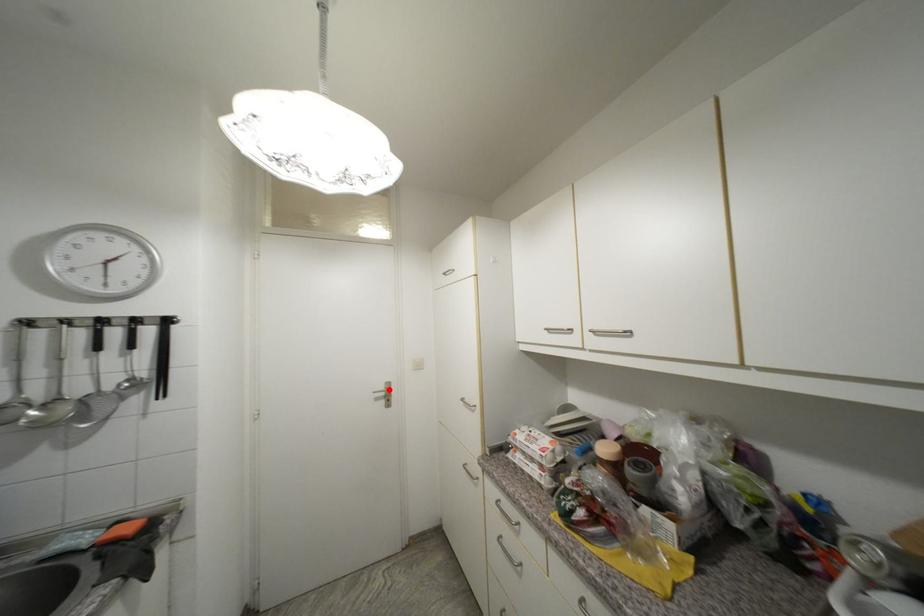
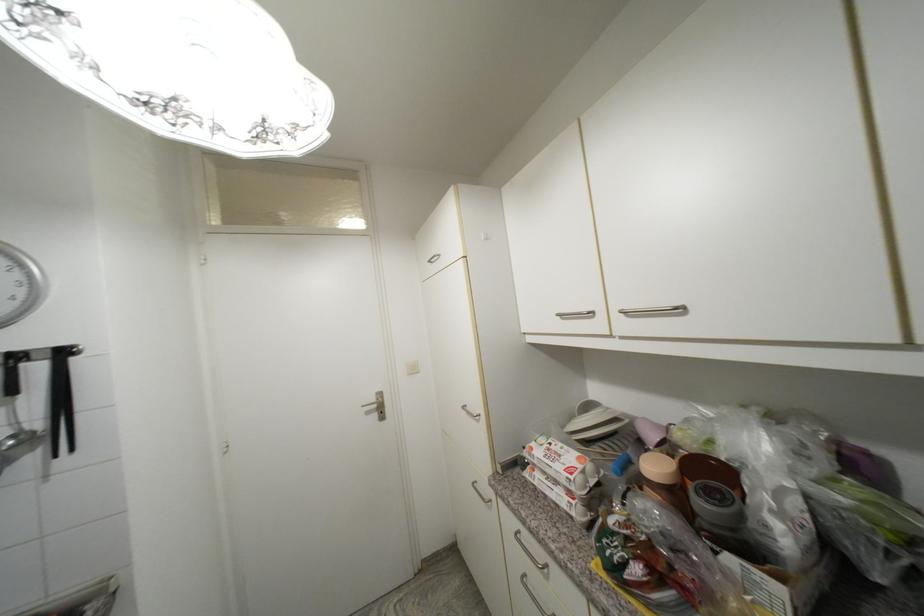
Where in the second image is the point corresponding to the highlighted location from the first image?

(380, 400)